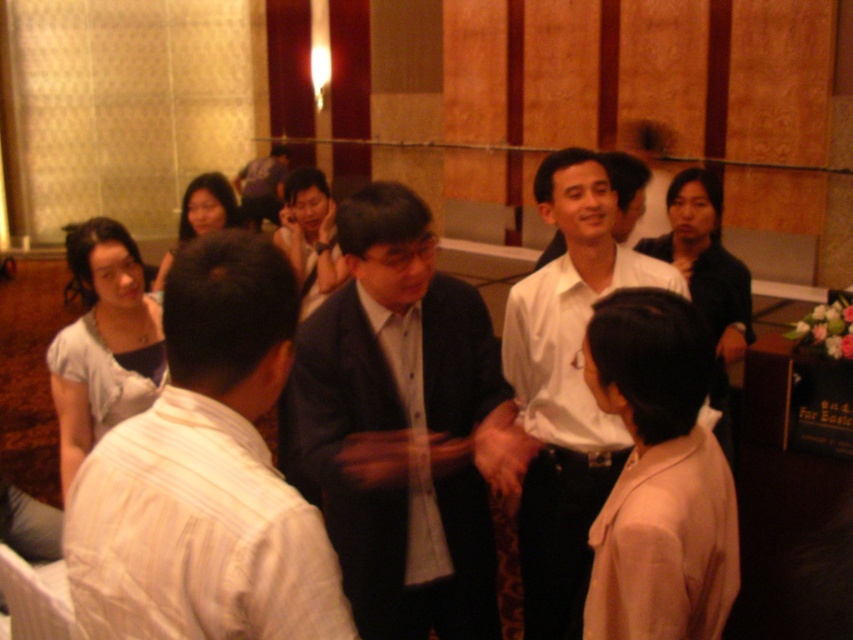
The height and width of the screenshot is (640, 853). What do you see at coordinates (566, 387) in the screenshot? I see `white smooth shirt at center` at bounding box center [566, 387].

Is white smooth shirt at center bigger than light gray fabric dress at lower left?

Yes, white smooth shirt at center is bigger than light gray fabric dress at lower left.

This screenshot has height=640, width=853. What are the coordinates of `white smooth shirt at center` in the screenshot? It's located at (566, 387).

Does point (550, 352) lie in front of point (210, 195)?

That is True.

Locate an element on the screen. This screenshot has width=853, height=640. white smooth shirt at center is located at coordinates (566, 387).

Is point (671, 285) more distant than point (190, 204)?

No, it is in front of (190, 204).

Locate an element on the screen. This screenshot has height=640, width=853. white smooth shirt at center is located at coordinates (566, 387).

Is point (701, 372) less distant than point (306, 234)?

Yes.

Is point (695, 513) less distant than point (303, 208)?

Yes, it is in front of point (303, 208).

Locate an element on the screen. The image size is (853, 640). beige fabric blouse at center is located at coordinates point(659,476).